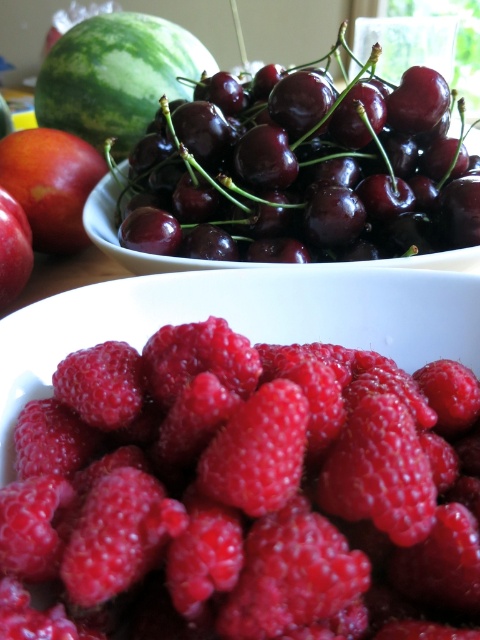
From the picture: Is green matte watermelon at upper left to the left of matte orange peach at upper left from the viewer's perspective?

No, green matte watermelon at upper left is not to the left of matte orange peach at upper left.

Describe the element at coordinates (116, 76) in the screenshot. This screenshot has height=640, width=480. I see `green matte watermelon at upper left` at that location.

Measure the distance between green matte watermelon at upper left and camera.

They are 3.63 feet apart.

Locate an element on the screen. The width and height of the screenshot is (480, 640). green matte watermelon at upper left is located at coordinates (x=116, y=76).

Is shiny red raspberry at center wider than matte orange peach at upper left?

Correct, the width of shiny red raspberry at center exceeds that of matte orange peach at upper left.

Is point (292, 534) farther from viewer compared to point (34, 161)?

No, (292, 534) is closer to viewer.

The image size is (480, 640). I want to click on shiny red raspberry at center, so click(244, 493).

Is shiny red raspberry at center further to camera compared to green matte watermelon at upper left?

No, it is in front of green matte watermelon at upper left.

Between shiny red raspberry at center and green matte watermelon at upper left, which one is positioned higher?

Positioned higher is green matte watermelon at upper left.

Between point (179, 332) and point (118, 67), which one is positioned in front?

Point (179, 332) is more forward.

The height and width of the screenshot is (640, 480). In order to click on shiny red raspberry at center in this screenshot , I will do `click(244, 493)`.